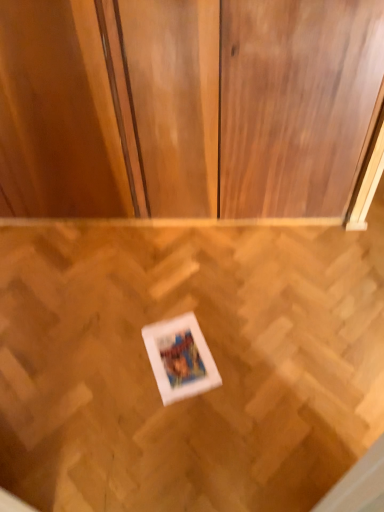
Locate an element on the screen. free spot below matte wood dresser at center (from a real-world perspective) is located at coordinates (159, 216).